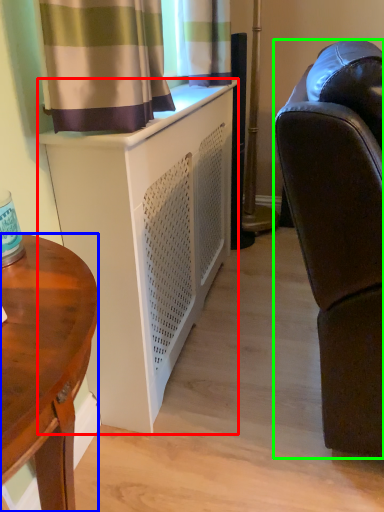
Question: Which is nearer to the cabinetry (highlighted by a red box)? desk (highlighted by a blue box) or studio couch (highlighted by a green box).

Choices:
 (A) desk
 (B) studio couch

Answer: (B)